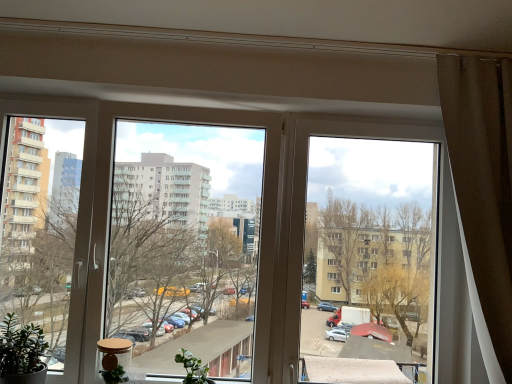
Question: Is brown fabric curtain at right positioned before transparent plastic window at center, the 1th window when ordered from left to right?

Choices:
 (A) yes
 (B) no

Answer: (A)

Question: From the image's perspective, does brown fabric curtain at right appear lower than transparent plastic window at center, the 1th window when ordered from left to right?

Choices:
 (A) no
 (B) yes

Answer: (A)

Question: From a real-world perspective, is brown fabric curtain at right beneath transparent plastic window at center, which is counted as the 2th window, starting from the right?

Choices:
 (A) yes
 (B) no

Answer: (B)

Question: From a real-world perspective, is brown fabric curtain at right on top of transparent plastic window at center, the 1th window when ordered from left to right?

Choices:
 (A) no
 (B) yes

Answer: (B)

Question: Does brown fabric curtain at right turn towards transparent plastic window at center, which is counted as the 2th window, starting from the right?

Choices:
 (A) yes
 (B) no

Answer: (B)

Question: Is green matte plant at lower center, marked as the first plant in a right-to-left arrangement, wider or thinner than green matte plant at lower left, arranged as the first plant when viewed from the left?

Choices:
 (A) wide
 (B) thin

Answer: (B)

Question: From a real-world perspective, is green matte plant at lower center, which appears as the 2th plant when viewed from the left, physically located above or below green matte plant at lower left, arranged as the first plant when viewed from the left?

Choices:
 (A) below
 (B) above

Answer: (A)

Question: Is green matte plant at lower center, which appears as the 2th plant when viewed from the left, spatially inside green matte plant at lower left, arranged as the first plant when viewed from the left, or outside of it?

Choices:
 (A) inside
 (B) outside

Answer: (B)

Question: In terms of size, does green matte plant at lower center, marked as the first plant in a right-to-left arrangement, appear bigger or smaller than green matte plant at lower left, placed as the second plant when sorted from right to left?

Choices:
 (A) small
 (B) big

Answer: (A)

Question: Considering the positions of point (493, 175) and point (16, 349), is point (493, 175) closer or farther from the camera than point (16, 349)?

Choices:
 (A) closer
 (B) farther

Answer: (A)

Question: Is brown fabric curtain at right wider or thinner than green matte plant at lower left, arranged as the first plant when viewed from the left?

Choices:
 (A) thin
 (B) wide

Answer: (B)

Question: From the image's perspective, is brown fabric curtain at right above or below green matte plant at lower left, arranged as the first plant when viewed from the left?

Choices:
 (A) above
 (B) below

Answer: (A)

Question: Do you think brown fabric curtain at right is within green matte plant at lower left, placed as the second plant when sorted from right to left, or outside of it?

Choices:
 (A) inside
 (B) outside

Answer: (B)

Question: Considering the positions of brown fabric curtain at right and green matte plant at lower center, marked as the first plant in a right-to-left arrangement, in the image, is brown fabric curtain at right taller or shorter than green matte plant at lower center, marked as the first plant in a right-to-left arrangement,?

Choices:
 (A) tall
 (B) short

Answer: (A)

Question: From a real-world perspective, relative to green matte plant at lower center, marked as the first plant in a right-to-left arrangement, is brown fabric curtain at right vertically above or below?

Choices:
 (A) above
 (B) below

Answer: (A)